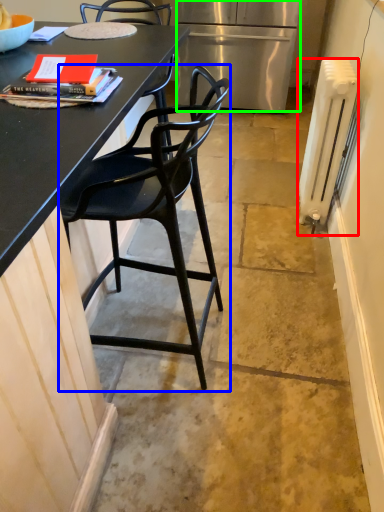
Question: Which is farther away from radiator (highlighted by a red box)? chair (highlighted by a blue box) or refrigerator (highlighted by a green box)?

Choices:
 (A) chair
 (B) refrigerator

Answer: (B)